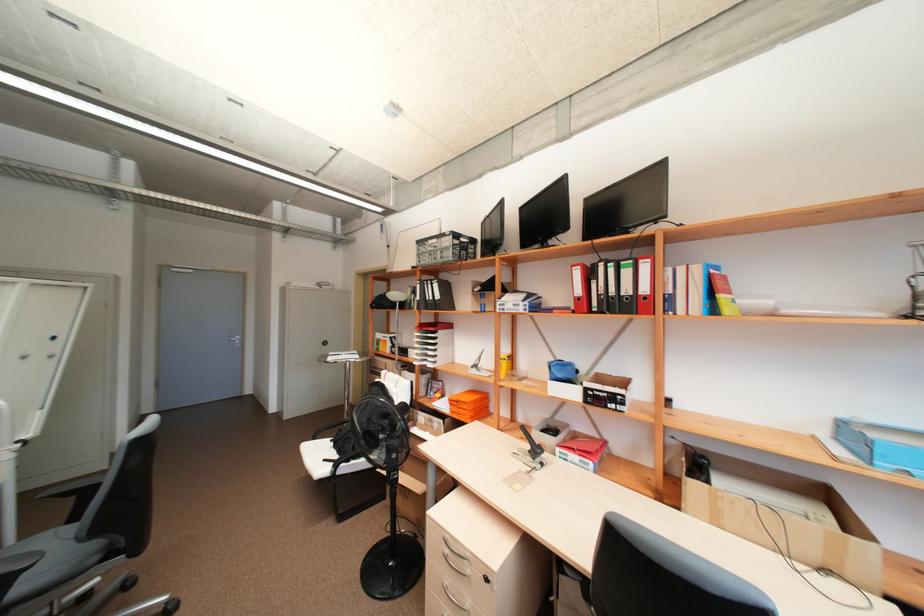
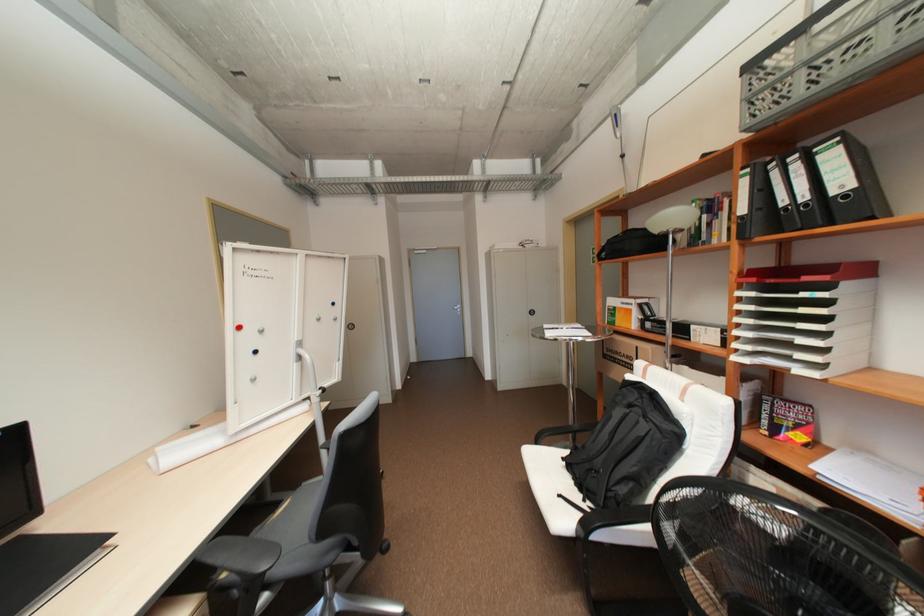
Find the pixel in the second image that matches (x=420, y=363) in the first image.

(742, 358)